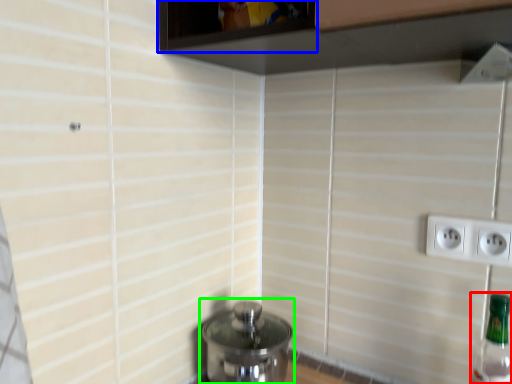
Question: Which object is the farthest from bottle (highlighted by a red box)? Choose among these: window (highlighted by a blue box) or water heater (highlighted by a green box).

Choices:
 (A) window
 (B) water heater

Answer: (A)